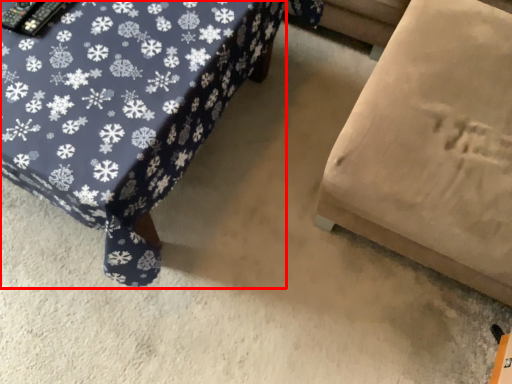
Question: From the image's perspective, where is furniture (annotated by the red box) located relative to furniture?

Choices:
 (A) below
 (B) above

Answer: (A)